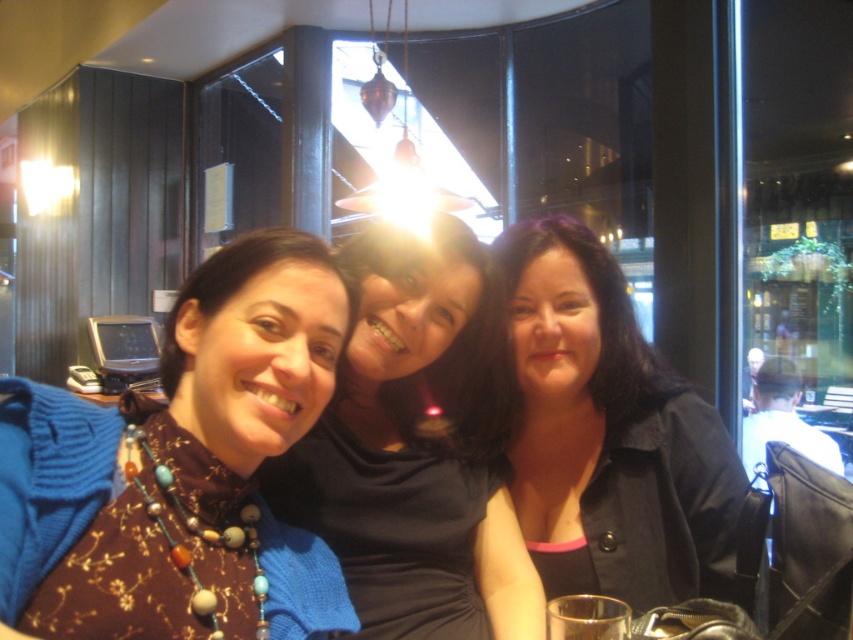
Question: Can you confirm if matte black dress at center is bigger than black matte jacket at center?

Choices:
 (A) no
 (B) yes

Answer: (B)

Question: Among these objects, which one is farthest from the camera?

Choices:
 (A) matte black dress at center
 (B) black matte jacket at center
 (C) brown fabric sweater at center

Answer: (B)

Question: Which object is positioned closest to the brown fabric sweater at center?

Choices:
 (A) matte black dress at center
 (B) black matte jacket at center

Answer: (A)

Question: Which point is farther to the camera?

Choices:
 (A) brown fabric sweater at center
 (B) matte black dress at center
 (C) black matte jacket at center

Answer: (C)

Question: Observing the image, what is the correct spatial positioning of matte black dress at center in reference to black matte jacket at center?

Choices:
 (A) below
 (B) above

Answer: (A)

Question: Is matte black dress at center bigger than black matte jacket at center?

Choices:
 (A) no
 (B) yes

Answer: (B)